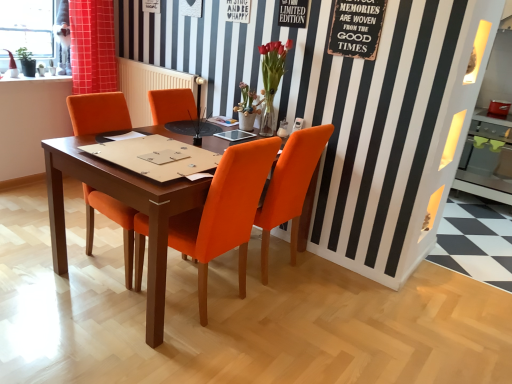
Identify the location of free spot to the right of orange fabric chair at center, positioned as the 2th chair in left-to-right order. Image resolution: width=512 pixels, height=384 pixels. (291, 324).